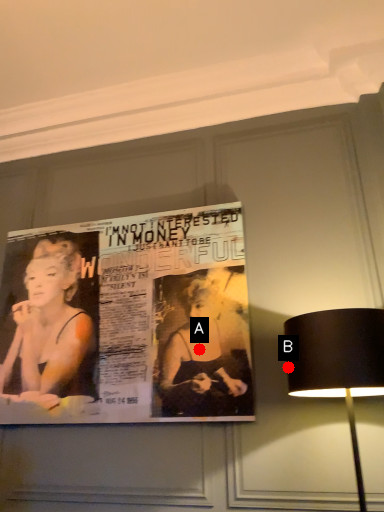
Question: Two points are circled on the image, labeled by A and B beside each circle. Which point appears farthest from the camera in this image?

Choices:
 (A) A is further
 (B) B is further

Answer: (A)